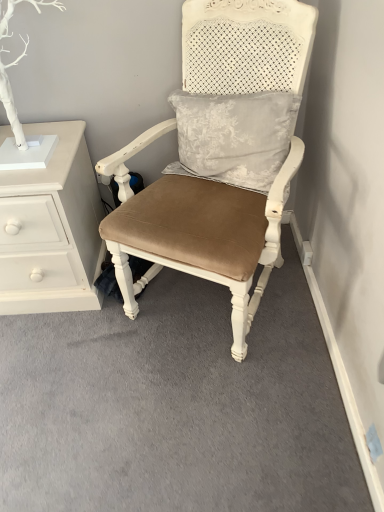
Question: Considering the positions of white painted wood chest of drawers at left and suede-like tan cushion at center in the image, is white painted wood chest of drawers at left taller or shorter than suede-like tan cushion at center?

Choices:
 (A) short
 (B) tall

Answer: (A)

Question: Is white painted wood chest of drawers at left wider or thinner than suede-like tan cushion at center?

Choices:
 (A) wide
 (B) thin

Answer: (B)

Question: Relative to suede-like tan cushion at center, is white painted wood chest of drawers at left in front or behind?

Choices:
 (A) behind
 (B) front

Answer: (A)

Question: Considering the relative positions of suede-like tan cushion at center and white painted wood chest of drawers at left in the image provided, is suede-like tan cushion at center to the left or to the right of white painted wood chest of drawers at left?

Choices:
 (A) right
 (B) left

Answer: (A)

Question: Based on their sizes in the image, would you say suede-like tan cushion at center is bigger or smaller than white painted wood chest of drawers at left?

Choices:
 (A) big
 (B) small

Answer: (A)

Question: Is suede-like tan cushion at center in front of or behind white painted wood chest of drawers at left in the image?

Choices:
 (A) behind
 (B) front

Answer: (B)

Question: From the image's perspective, is suede-like tan cushion at center positioned above or below white painted wood chest of drawers at left?

Choices:
 (A) above
 (B) below

Answer: (A)